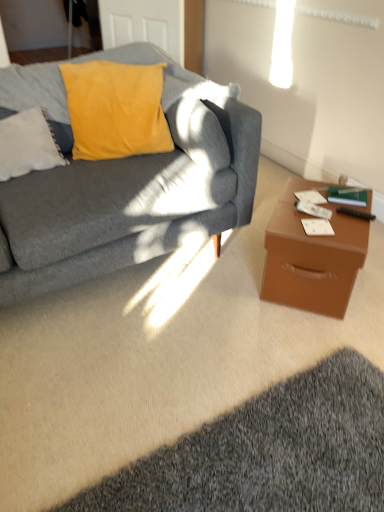
Question: From the image's perspective, is dark gray shaggy rug at lower right over brown leather desk at right?

Choices:
 (A) no
 (B) yes

Answer: (A)

Question: Is dark gray shaggy rug at lower right shorter than brown leather desk at right?

Choices:
 (A) yes
 (B) no

Answer: (A)

Question: Considering the relative sizes of dark gray shaggy rug at lower right and brown leather desk at right in the image provided, is dark gray shaggy rug at lower right taller than brown leather desk at right?

Choices:
 (A) no
 (B) yes

Answer: (A)

Question: Is dark gray shaggy rug at lower right with brown leather desk at right?

Choices:
 (A) yes
 (B) no

Answer: (B)

Question: Is dark gray shaggy rug at lower right not near brown leather desk at right?

Choices:
 (A) yes
 (B) no

Answer: (B)

Question: Can you confirm if dark gray shaggy rug at lower right is positioned to the left of brown leather desk at right?

Choices:
 (A) no
 (B) yes

Answer: (B)

Question: Is black plastic remote control at right oriented away from dark gray shaggy rug at lower right?

Choices:
 (A) yes
 (B) no

Answer: (B)

Question: Is black plastic remote control at right at the left side of dark gray shaggy rug at lower right?

Choices:
 (A) no
 (B) yes

Answer: (A)

Question: Is black plastic remote control at right to the right of dark gray shaggy rug at lower right from the viewer's perspective?

Choices:
 (A) yes
 (B) no

Answer: (A)

Question: Are black plastic remote control at right and dark gray shaggy rug at lower right far apart?

Choices:
 (A) yes
 (B) no

Answer: (B)

Question: Is black plastic remote control at right taller than dark gray shaggy rug at lower right?

Choices:
 (A) no
 (B) yes

Answer: (A)

Question: From the image's perspective, would you say black plastic remote control at right is shown under dark gray shaggy rug at lower right?

Choices:
 (A) yes
 (B) no

Answer: (B)

Question: Does black plastic remote control at right have a smaller size compared to brown leather desk at right?

Choices:
 (A) no
 (B) yes

Answer: (B)